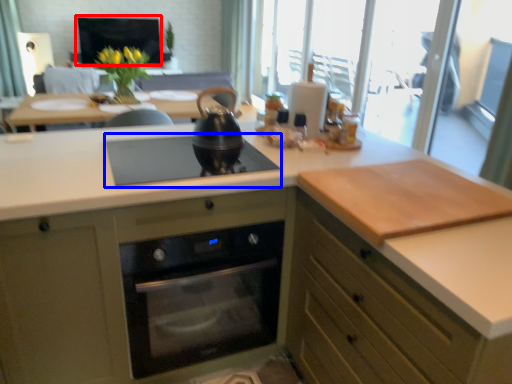
Question: Which object appears closest to the camera in this image, window screen (highlighted by a red box) or gas stove (highlighted by a blue box)?

Choices:
 (A) window screen
 (B) gas stove

Answer: (B)